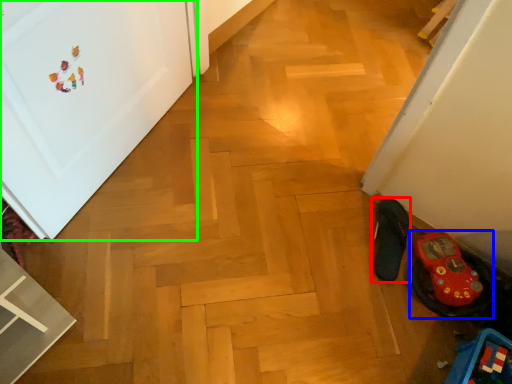
Question: Considering the real-world distances, which object is farthest from footwear (highlighted by a red box)? footwear (highlighted by a blue box) or door (highlighted by a green box)?

Choices:
 (A) footwear
 (B) door

Answer: (B)